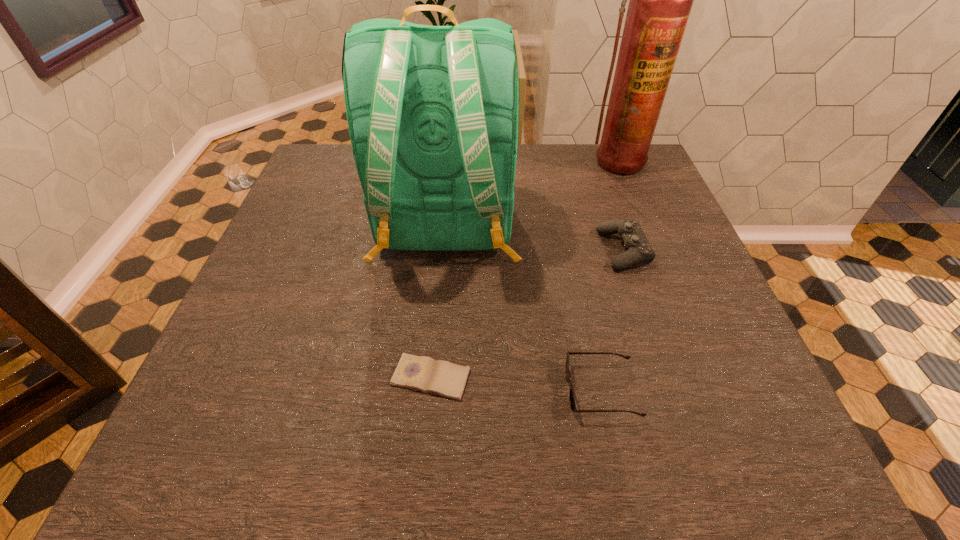
The height and width of the screenshot is (540, 960). In order to click on fire extinguisher in this screenshot , I will do `click(660, 0)`.

Locate an element on the screen. The width and height of the screenshot is (960, 540). backpack is located at coordinates (433, 111).

You are a GUI agent. You are given a task and a screenshot of the screen. Output one action in this format:
    pyautogui.click(x=<x>, y=<y>)
    Task: Click on the third shortest object
    Image resolution: width=960 pixels, height=540 pixels.
    Given the screenshot: What is the action you would take?
    pyautogui.click(x=638, y=247)

Where is `the fourth tallest object`? the fourth tallest object is located at coordinates (573, 404).

You are a GUI agent. You are given a task and a screenshot of the screen. Output one action in this format:
    pyautogui.click(x=<x>, y=<y>)
    Task: Click on the sunglasses
    The height and width of the screenshot is (540, 960).
    Given the screenshot: What is the action you would take?
    pyautogui.click(x=573, y=404)

The height and width of the screenshot is (540, 960). I want to click on the shortest object, so pyautogui.click(x=422, y=373).

The image size is (960, 540). I want to click on vacant area situated on the side of the farthest object with the label, so click(632, 204).

Find the location of a particular element. Image resolution: width=960 pixels, height=540 pixels. free spot located 0.130m on the back of the backpack is located at coordinates (436, 338).

Locate an element on the screen. vacant space located 0.130m on the back of the third tallest object is located at coordinates (606, 199).

Where is `free space located on the front lenses of the second shortest object`? The height and width of the screenshot is (540, 960). free space located on the front lenses of the second shortest object is located at coordinates (507, 391).